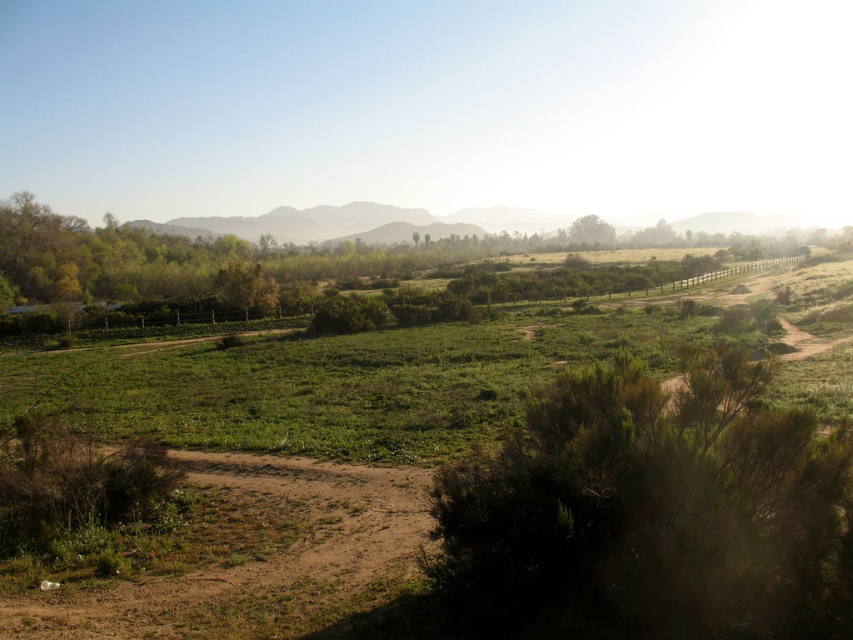
Between point (450, 568) and point (196, 490), which one is positioned behind?

The point (196, 490) is more distant.

Who is lower down, dark green bush at lower right or brown dirt track at lower left?

brown dirt track at lower left is below.

I want to click on dark green bush at lower right, so click(x=653, y=513).

How far apart are brown dirt track at lower left and green grassy hillside at center?

brown dirt track at lower left is 210.85 meters away from green grassy hillside at center.

What do you see at coordinates (242, 556) in the screenshot?
I see `brown dirt track at lower left` at bounding box center [242, 556].

The height and width of the screenshot is (640, 853). Describe the element at coordinates (242, 556) in the screenshot. I see `brown dirt track at lower left` at that location.

The width and height of the screenshot is (853, 640). I want to click on brown dirt track at lower left, so click(x=242, y=556).

Which is below, dark green bush at lower right or brown textured tree at center?

Positioned lower is dark green bush at lower right.

Can you confirm if dark green bush at lower right is positioned below brown textured tree at center?

Indeed, dark green bush at lower right is positioned under brown textured tree at center.

The image size is (853, 640). Find the location of `dark green bush at lower right`. dark green bush at lower right is located at coordinates (653, 513).

This screenshot has height=640, width=853. I want to click on dark green bush at lower right, so click(653, 513).